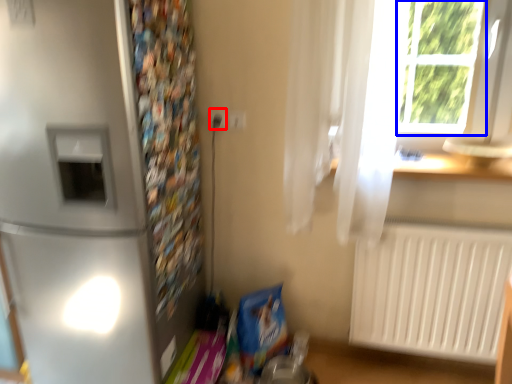
Question: Which object appears closest to the camera in this image, electric outlet (highlighted by a red box) or window frame (highlighted by a blue box)?

Choices:
 (A) electric outlet
 (B) window frame

Answer: (B)